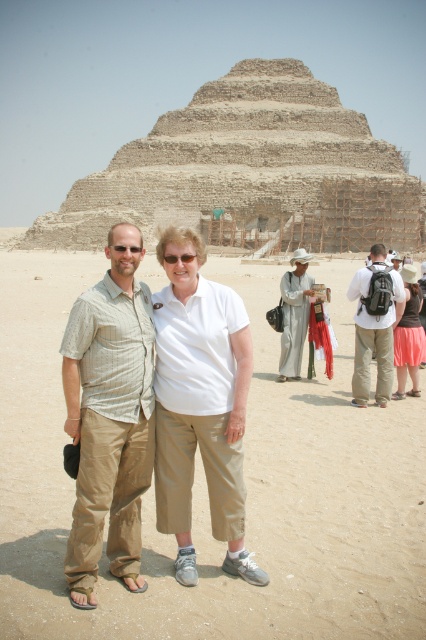
You are a tour guide at the Step Pyramid of Djoser. You notice two tourists at coordinates point [380,397] and point [284,308]. Which tourist is closer to the entrance of the pyramid?

Point [380,397] is in front of point [284,308], so the tourist at point [380,397] is closer to the entrance of the pyramid.

You are a tour guide at the Step Pyramid of Djoser. You notice two visitors wearing the light beige linen shirt at center and the pink fabric skirt at lower right. Which clothing item is bigger in size?

The light beige linen shirt at center is larger in size than the pink fabric skirt at lower right.

You are standing at the Step Pyramid of Djoser and want to take a photo of the two points marked in the image. Which point, point (63,356) or point (80,301), is closer to you?

Point (63,356) is closer to the viewer than point (80,301).